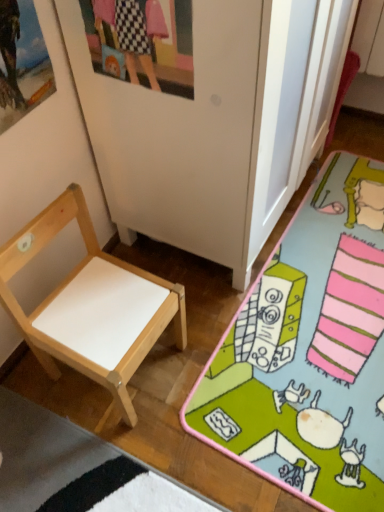
Question: Should I look upward or downward to see natural wood chair at left?

Choices:
 (A) up
 (B) down

Answer: (B)

Question: Can you confirm if natural wood chair at left is positioned to the right of matte plastic picture frame at upper center, which is the 2th picture frame in left-to-right order?

Choices:
 (A) yes
 (B) no

Answer: (B)

Question: Is natural wood chair at left bigger than matte plastic picture frame at upper center, which is the 2th picture frame in left-to-right order?

Choices:
 (A) yes
 (B) no

Answer: (A)

Question: Is natural wood chair at left in front of matte plastic picture frame at upper center, which is the 2th picture frame in left-to-right order?

Choices:
 (A) yes
 (B) no

Answer: (B)

Question: Are natural wood chair at left and matte plastic picture frame at upper center, which is the 2th picture frame in left-to-right order, far apart?

Choices:
 (A) no
 (B) yes

Answer: (A)

Question: Is natural wood chair at left oriented away from matte plastic picture frame at upper center, which is the 2th picture frame in left-to-right order?

Choices:
 (A) yes
 (B) no

Answer: (B)

Question: Does natural wood chair at left have a lesser height compared to matte plastic picture frame at upper center, which is the 2th picture frame in left-to-right order?

Choices:
 (A) yes
 (B) no

Answer: (B)

Question: From the image's perspective, is wooden picture frame at upper left, which ranks as the 1th picture frame in left-to-right order, located beneath matte plastic picture frame at upper center, which is the 2th picture frame in left-to-right order?

Choices:
 (A) yes
 (B) no

Answer: (A)

Question: Does wooden picture frame at upper left, which ranks as the 1th picture frame in left-to-right order, have a smaller size compared to matte plastic picture frame at upper center, which is the 2th picture frame in left-to-right order?

Choices:
 (A) no
 (B) yes

Answer: (A)

Question: From the image's perspective, is wooden picture frame at upper left, the 2th picture frame from the right, above matte plastic picture frame at upper center, the 1th picture frame from the right?

Choices:
 (A) no
 (B) yes

Answer: (A)

Question: Does wooden picture frame at upper left, which ranks as the 1th picture frame in left-to-right order, have a larger size compared to matte plastic picture frame at upper center, which is the 2th picture frame in left-to-right order?

Choices:
 (A) yes
 (B) no

Answer: (A)

Question: Can you confirm if wooden picture frame at upper left, the 2th picture frame from the right, is thinner than matte plastic picture frame at upper center, the 1th picture frame from the right?

Choices:
 (A) yes
 (B) no

Answer: (B)

Question: Considering the relative sizes of wooden picture frame at upper left, which ranks as the 1th picture frame in left-to-right order, and matte plastic picture frame at upper center, the 1th picture frame from the right, in the image provided, is wooden picture frame at upper left, which ranks as the 1th picture frame in left-to-right order, taller than matte plastic picture frame at upper center, the 1th picture frame from the right,?

Choices:
 (A) no
 (B) yes

Answer: (A)

Question: Is wooden picture frame at upper left, which ranks as the 1th picture frame in left-to-right order, at the left side of natural wood chair at left?

Choices:
 (A) no
 (B) yes

Answer: (B)